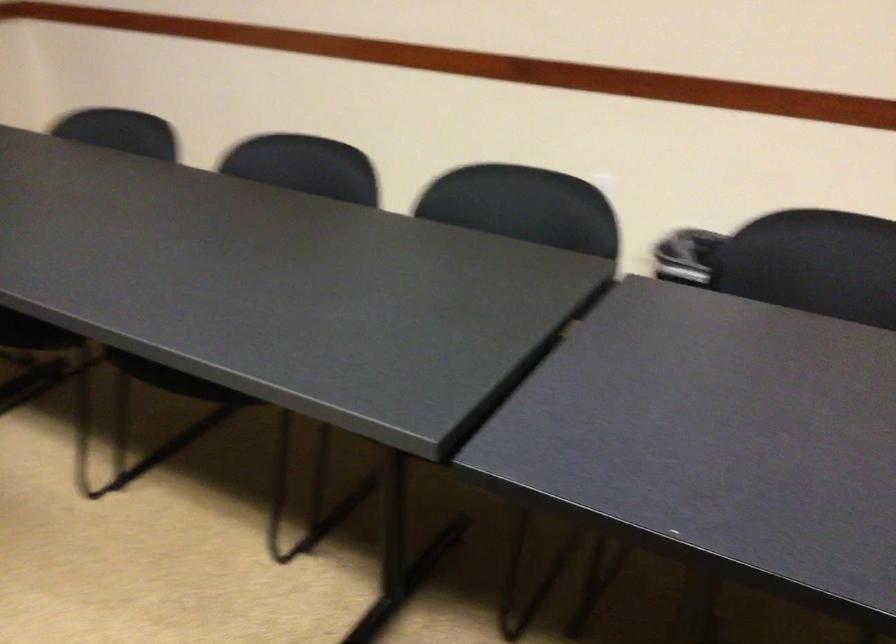
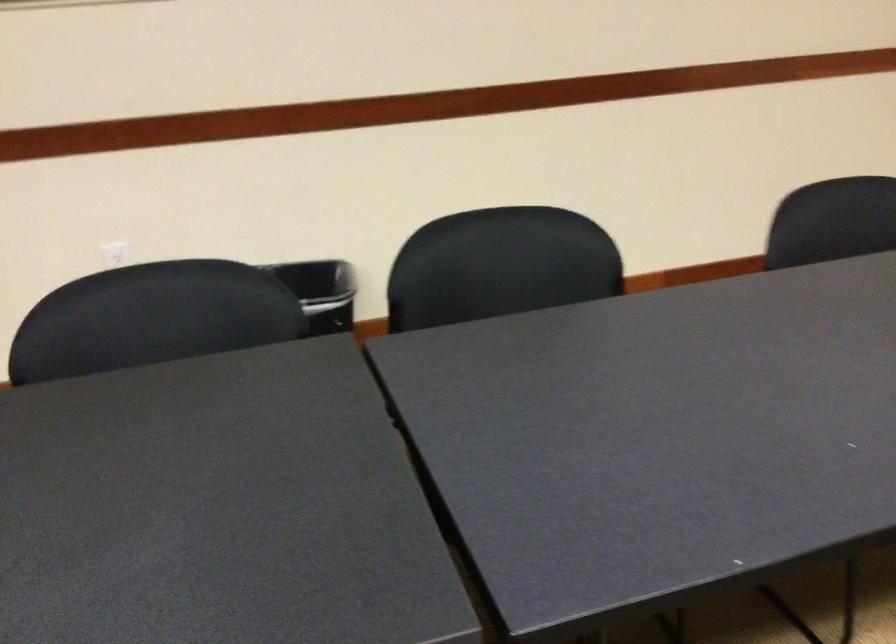
Question: The camera is either moving clockwise (left) or counter-clockwise (right) around the object. The first image is from the beginning of the video and the second image is from the end. Is the camera moving left or right when shooting the video?

Choices:
 (A) Left
 (B) Right

Answer: (A)